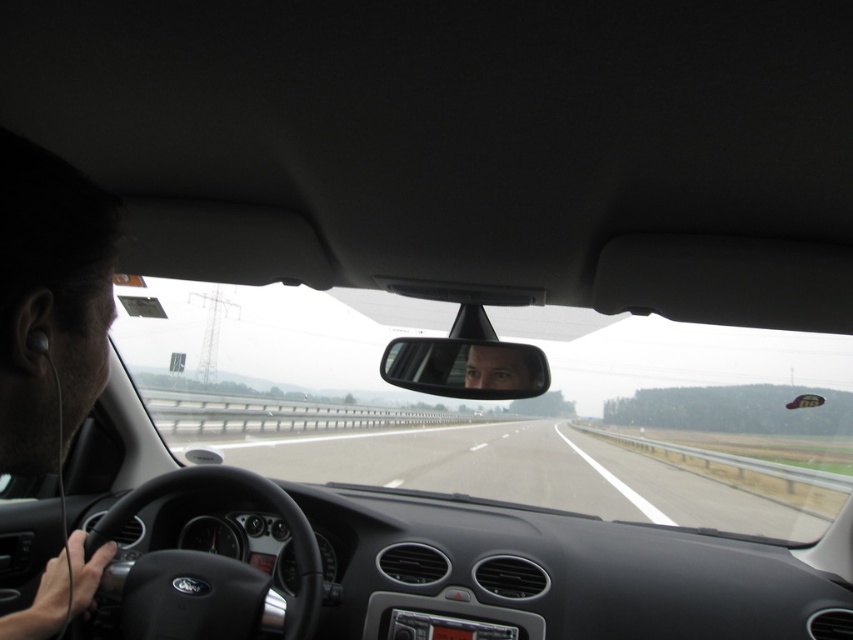
You are driving a car and looking at the highway ahead. There are two points marked on your windshield at coordinates point (3, 161) and point (486, 376). From your perspective inside the car, which point is closer to you?

Point (3, 161) is in front of point (486, 376), so it is closer to you.

Looking at this image, you are driving a car and want to check the road ahead and your blind spot. The transparent glass windshield at center and clear plastic mirror at center are both in your view. Which object allows you to see further ahead?

The transparent glass windshield at center allows you to see further ahead because it is positioned in front of the clear plastic mirror at center, providing a direct forward view.

You are a passenger in the car and want to look through the transparent glass windshield at center to see the highway ahead. Based on its position coordinates, is the windshield located more towards the top or bottom of the image?

The transparent glass windshield at center is located at coordinates point (505, 410). Since the y coordinate is 0.593, which is closer to 1 than to 0, it is positioned more towards the bottom of the image.